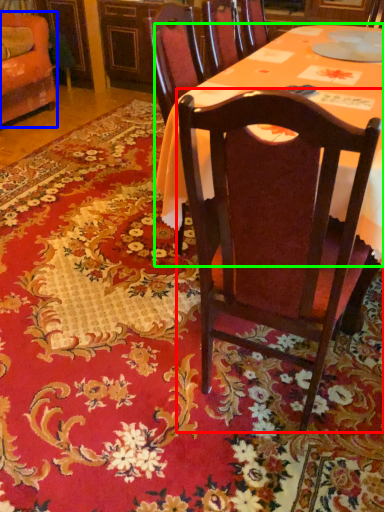
Question: Based on their relative distances, which object is nearer to chair (highlighted by a red box)? Choose from chair (highlighted by a blue box) and desk (highlighted by a green box).

Choices:
 (A) chair
 (B) desk

Answer: (B)